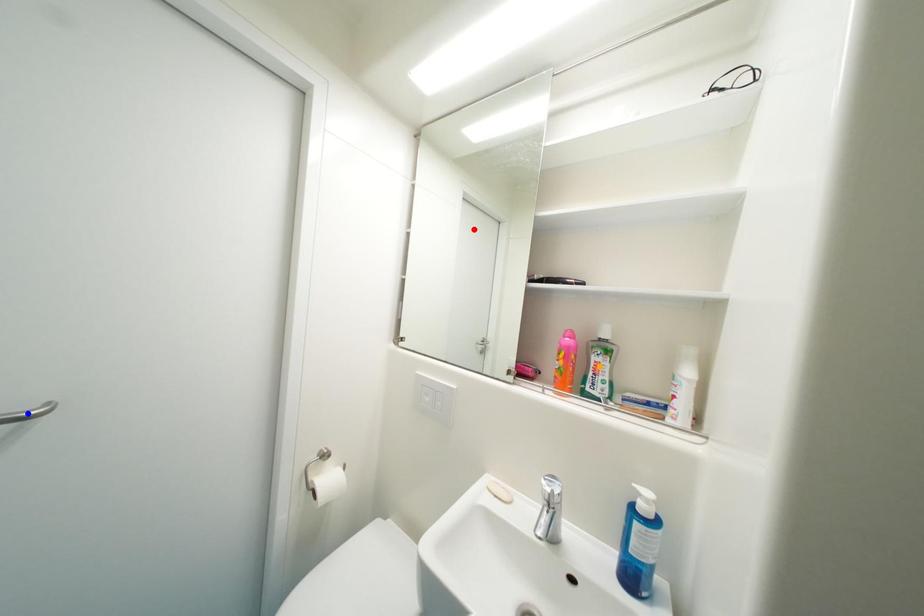
Order these from nearest to farthest:
orange point
blue point
red point

blue point, orange point, red point